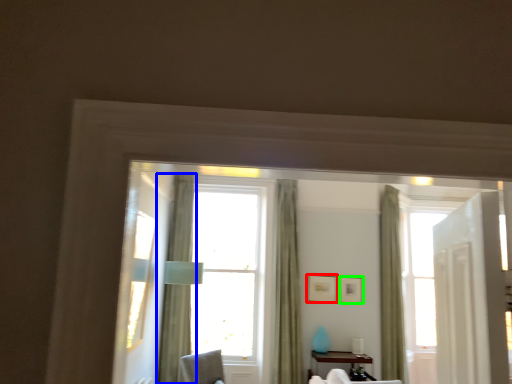
Question: Which is nearer to the picture frame (highlighted by a red box)? curtain (highlighted by a blue box) or picture frame (highlighted by a green box).

Choices:
 (A) curtain
 (B) picture frame

Answer: (B)